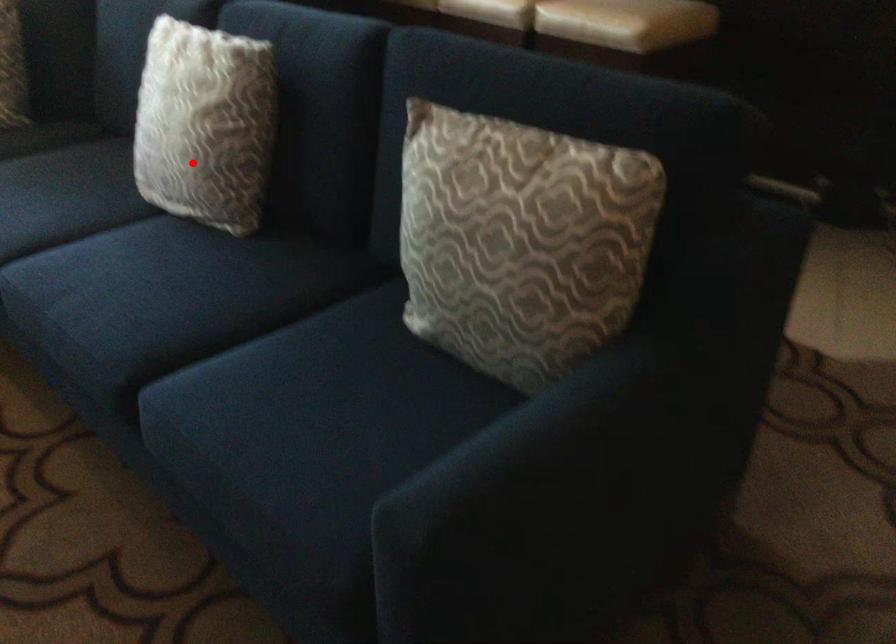
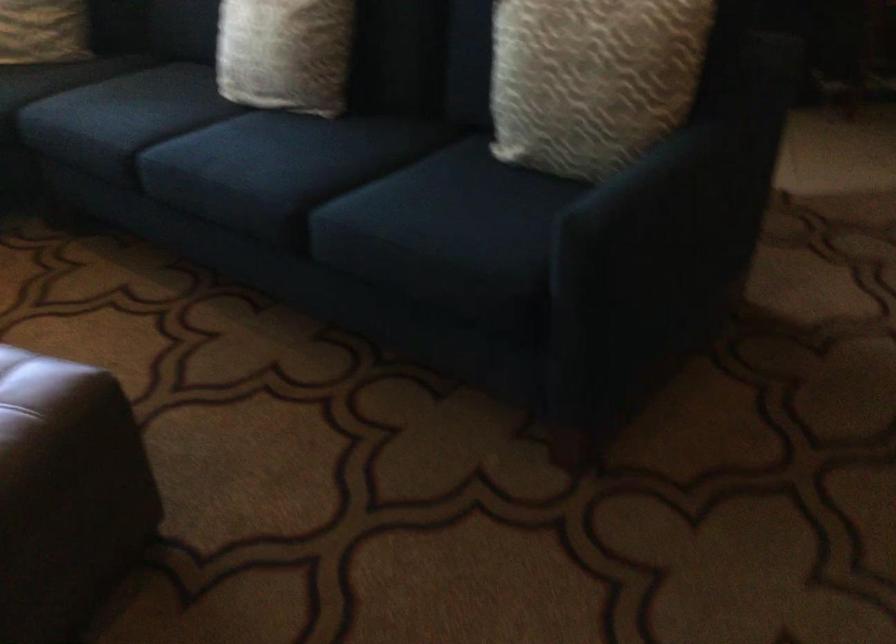
Where in the second image is the point corresponding to the highlighted location from the first image?

(285, 53)